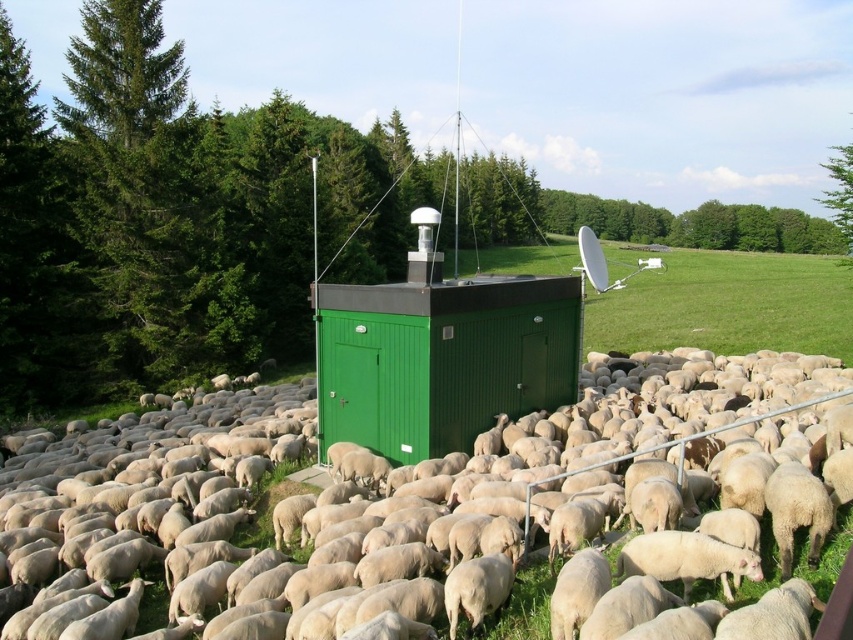
You are a farmer checking the sheep in the field. You notice the white woolly sheep at center and the green corrugated metal hut at center. From your position, which object is positioned to the right?

The white woolly sheep at center is positioned to the right of the green corrugated metal hut at center.

You are a photographer standing at the edge of the field. You want to take a picture of the green corrugated metal hut at center and the white woolly sheep at center. Which object should you focus on first to ensure both are in sharp focus?

The white woolly sheep at center is closer to the viewer than the green corrugated metal hut at center. To ensure both are in sharp focus, you should focus on the white woolly sheep at center first.

You are a farmer who needs to count the number of white woolly sheep at center and green corrugated metal hut at center in the field. Which object is larger in size?

The white woolly sheep at center is bigger than the green corrugated metal hut at center.